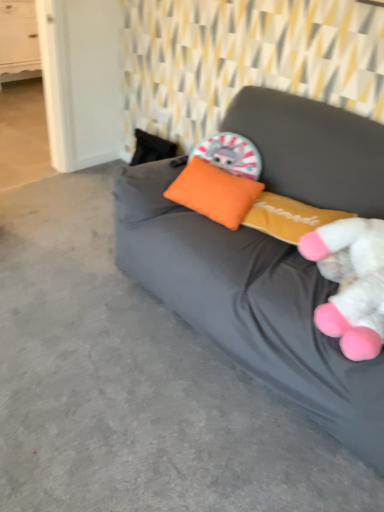
Question: Is white plush toy at right oriented towards orange fabric pillow at center?

Choices:
 (A) yes
 (B) no

Answer: (B)

Question: From the image's perspective, would you say white plush toy at right is shown under orange fabric pillow at center?

Choices:
 (A) yes
 (B) no

Answer: (A)

Question: Is white plush toy at right positioned in front of orange fabric pillow at center?

Choices:
 (A) yes
 (B) no

Answer: (A)

Question: Does white plush toy at right appear on the left side of orange fabric pillow at center?

Choices:
 (A) yes
 (B) no

Answer: (B)

Question: Is white plush toy at right looking in the opposite direction of orange fabric pillow at center?

Choices:
 (A) no
 (B) yes

Answer: (A)

Question: From a real-world perspective, is white plush toy at right located beneath orange fabric pillow at center?

Choices:
 (A) yes
 (B) no

Answer: (B)

Question: Is there a large distance between matte gray bean bag at center and white plush toy at right?

Choices:
 (A) no
 (B) yes

Answer: (A)

Question: Is matte gray bean bag at center aimed at white plush toy at right?

Choices:
 (A) no
 (B) yes

Answer: (B)

Question: From a real-world perspective, is matte gray bean bag at center over white plush toy at right?

Choices:
 (A) yes
 (B) no

Answer: (B)

Question: From a real-world perspective, is matte gray bean bag at center under white plush toy at right?

Choices:
 (A) yes
 (B) no

Answer: (A)

Question: Does matte gray bean bag at center lie behind white plush toy at right?

Choices:
 (A) yes
 (B) no

Answer: (B)

Question: Is matte gray bean bag at center at the left side of white plush toy at right?

Choices:
 (A) yes
 (B) no

Answer: (A)

Question: Is white plush toy at right oriented away from matte gray bean bag at center?

Choices:
 (A) yes
 (B) no

Answer: (A)